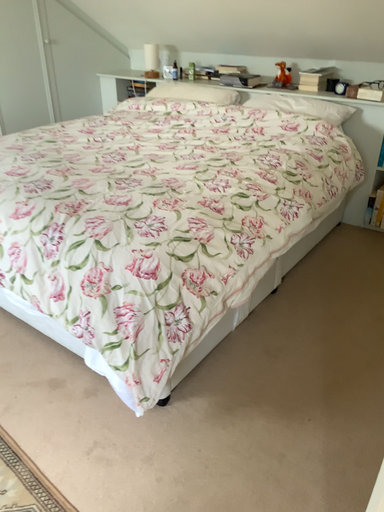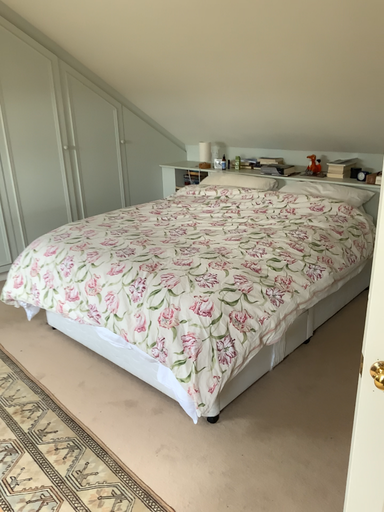
Question: How did the camera likely rotate when shooting the video?

Choices:
 (A) rotated downward
 (B) rotated upward

Answer: (B)